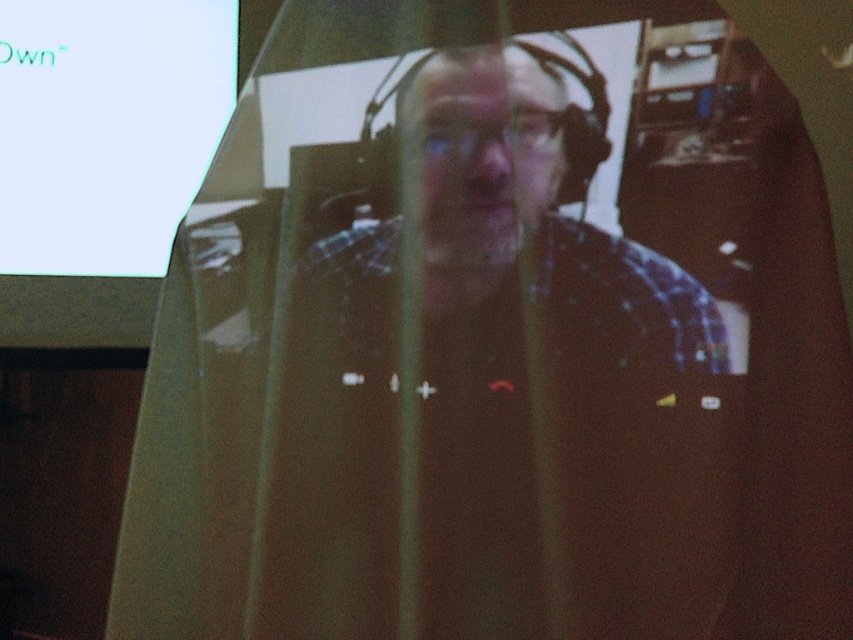
This screenshot has height=640, width=853. Describe the element at coordinates (494, 388) in the screenshot. I see `plaid shirt at center` at that location.

Does plaid shirt at center have a greater width compared to white glossy projection screen at upper left?

In fact, plaid shirt at center might be narrower than white glossy projection screen at upper left.

Which is in front, point (596, 445) or point (68, 208)?

Positioned in front is point (596, 445).

The width and height of the screenshot is (853, 640). I want to click on plaid shirt at center, so click(x=494, y=388).